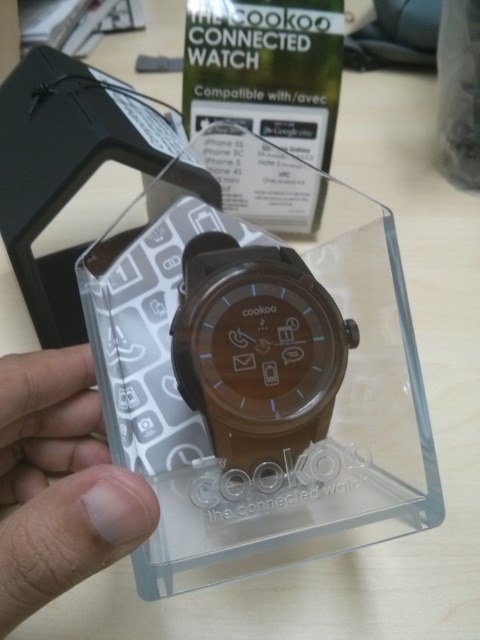
Question: Does brown matte watch at center have a lesser width compared to skinny white finger at lower left?

Choices:
 (A) yes
 (B) no

Answer: (A)

Question: Among these points, which one is nearest to the camera?

Choices:
 (A) (192, 259)
 (B) (48, 448)

Answer: (A)

Question: Which point is closer to the camera?

Choices:
 (A) (24, 564)
 (B) (230, 456)

Answer: (A)

Question: Can you confirm if brown matte watch at center is positioned below skinny white finger at lower left?

Choices:
 (A) no
 (B) yes

Answer: (A)

Question: Does brown matte watch at center appear over skinny white finger at lower left?

Choices:
 (A) no
 (B) yes

Answer: (B)